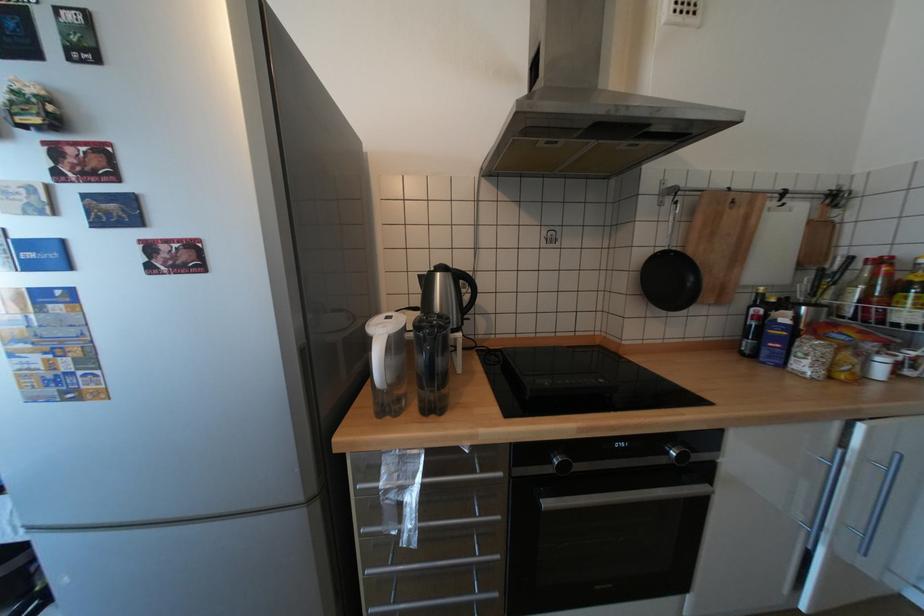
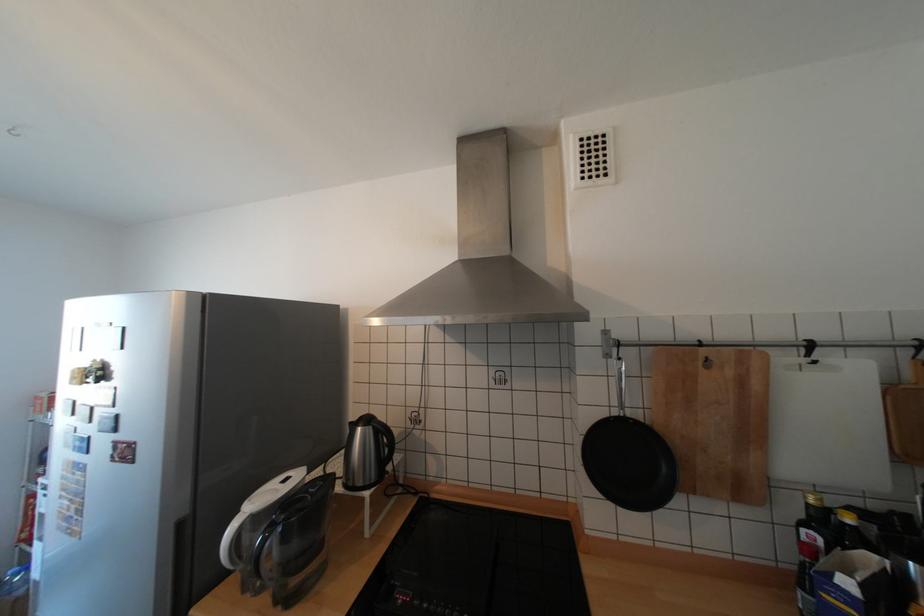
Locate, in the second image, the point that corresponds to the point at 174,254 in the first image.

(128, 451)